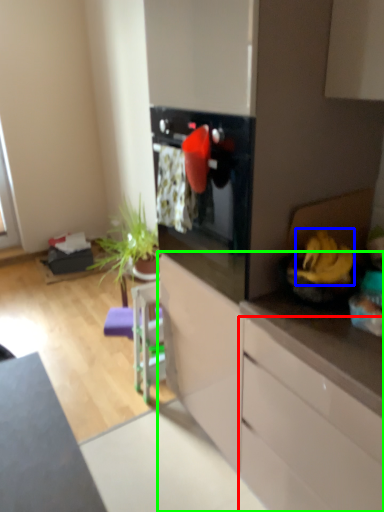
Question: Which object is the farthest from cabinetry (highlighted by a red box)? Choose among these: banana (highlighted by a blue box) or cabinetry (highlighted by a green box).

Choices:
 (A) banana
 (B) cabinetry

Answer: (A)